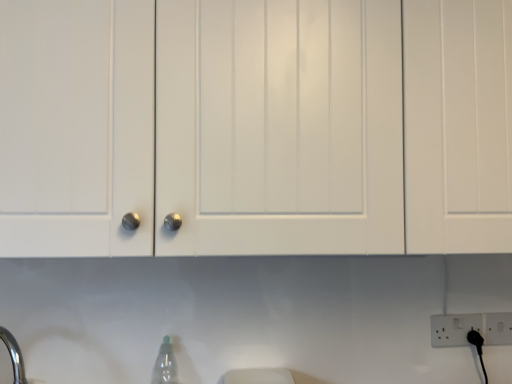
Describe the element at coordinates (453, 329) in the screenshot. The height and width of the screenshot is (384, 512). I see `white plastic electric outlet at lower right` at that location.

Where is `white matte cabinet at center`? white matte cabinet at center is located at coordinates (256, 127).

Is white matte cabinet at center turned away from transparent plastic bottle at lower center?

white matte cabinet at center does not have its back to transparent plastic bottle at lower center.

Does white matte cabinet at center have a greater height compared to transparent plastic bottle at lower center?

Indeed, white matte cabinet at center has a greater height compared to transparent plastic bottle at lower center.

Which is correct: white matte cabinet at center is inside transparent plastic bottle at lower center, or outside of it?

white matte cabinet at center is spatially situated outside transparent plastic bottle at lower center.

Which object is thinner, white matte cabinet at center or transparent plastic bottle at lower center?

Thinner between the two is transparent plastic bottle at lower center.

Which is more to the right, white plastic electric outlet at lower right or transparent plastic bottle at lower center?

white plastic electric outlet at lower right.

Between white plastic electric outlet at lower right and transparent plastic bottle at lower center, which one has less height?

white plastic electric outlet at lower right.

Can we say white plastic electric outlet at lower right lies outside transparent plastic bottle at lower center?

Absolutely, white plastic electric outlet at lower right is external to transparent plastic bottle at lower center.

Which object is further away from the camera taking this photo, white plastic electric outlet at lower right or transparent plastic bottle at lower center?

Positioned behind is white plastic electric outlet at lower right.

From the picture: Is white matte cabinet at center directly adjacent to white plastic electric outlet at lower right?

No, white matte cabinet at center is not with white plastic electric outlet at lower right.

From the image's perspective, relative to white plastic electric outlet at lower right, is white matte cabinet at center above or below?

Clearly, from the image's perspective, white matte cabinet at center is above white plastic electric outlet at lower right.

Who is more distant, white matte cabinet at center or white plastic electric outlet at lower right?

white plastic electric outlet at lower right is further away from the camera.

Is white matte cabinet at center oriented away from white plastic electric outlet at lower right?

No, white matte cabinet at center's orientation is not away from white plastic electric outlet at lower right.

From a real-world perspective, which object rests below the other?

transparent plastic bottle at lower center is physically lower.

From the image's perspective, between transparent plastic bottle at lower center and white plastic electric outlet at lower right, which one is located above?

From the image's view, white plastic electric outlet at lower right is above.

Considering the relative positions of transparent plastic bottle at lower center and white plastic electric outlet at lower right in the image provided, is transparent plastic bottle at lower center to the right of white plastic electric outlet at lower right from the viewer's perspective?

No.

Considering the sizes of objects transparent plastic bottle at lower center and white plastic electric outlet at lower right in the image provided, who is thinner, transparent plastic bottle at lower center or white plastic electric outlet at lower right?

white plastic electric outlet at lower right is thinner.

Considering the relative sizes of white plastic electric outlet at lower right and white matte cabinet at center in the image provided, is white plastic electric outlet at lower right smaller than white matte cabinet at center?

Indeed, white plastic electric outlet at lower right has a smaller size compared to white matte cabinet at center.

Is white plastic electric outlet at lower right turned away from white matte cabinet at center?

white plastic electric outlet at lower right is not turned away from white matte cabinet at center.

From the image's perspective, which one is positioned lower, white plastic electric outlet at lower right or white matte cabinet at center?

white plastic electric outlet at lower right appears lower in the image.

From a real-world perspective, is white plastic electric outlet at lower right on top of white matte cabinet at center?

Actually, white plastic electric outlet at lower right is physically below white matte cabinet at center in the real world.

Is white matte cabinet at center located within transparent plastic bottle at lower center?

No, white matte cabinet at center is not surrounded by transparent plastic bottle at lower center.

Looking at the image, does transparent plastic bottle at lower center seem bigger or smaller compared to white matte cabinet at center?

Considering their sizes, transparent plastic bottle at lower center takes up less space than white matte cabinet at center.

How different are the orientations of transparent plastic bottle at lower center and white matte cabinet at center in degrees?

transparent plastic bottle at lower center and white matte cabinet at center are facing 0.00148 degrees away from each other.

Identify the location of cabinetry that is in front of the transparent plastic bottle at lower center. The width and height of the screenshot is (512, 384). (256, 127).

What are the coordinates of `electric outlet positioned vertically above the transparent plastic bottle at lower center (from a real-world perspective)` in the screenshot? It's located at (453, 329).

Which object lies further to the anchor point white plastic electric outlet at lower right, transparent plastic bottle at lower center or white matte cabinet at center?

The object further to white plastic electric outlet at lower right is white matte cabinet at center.

From the image, which object appears to be nearer to white plastic electric outlet at lower right, white matte cabinet at center or transparent plastic bottle at lower center?

Based on the image, transparent plastic bottle at lower center appears to be nearer to white plastic electric outlet at lower right.

Estimate the real-world distances between objects in this image. Which object is closer to white matte cabinet at center, white plastic electric outlet at lower right or transparent plastic bottle at lower center?

transparent plastic bottle at lower center.

Looking at the image, which one is located closer to transparent plastic bottle at lower center, white plastic electric outlet at lower right or white matte cabinet at center?

white matte cabinet at center is positioned closer to the anchor transparent plastic bottle at lower center.

From the image, which object appears to be farther from white matte cabinet at center, transparent plastic bottle at lower center or white plastic electric outlet at lower right?

The object further to white matte cabinet at center is white plastic electric outlet at lower right.

Looking at the image, which one is located closer to transparent plastic bottle at lower center, white matte cabinet at center or white plastic electric outlet at lower right?

The object closer to transparent plastic bottle at lower center is white matte cabinet at center.

Where is `cabinetry between transparent plastic bottle at lower center and white plastic electric outlet at lower right`? The height and width of the screenshot is (384, 512). cabinetry between transparent plastic bottle at lower center and white plastic electric outlet at lower right is located at coordinates pyautogui.click(x=256, y=127).